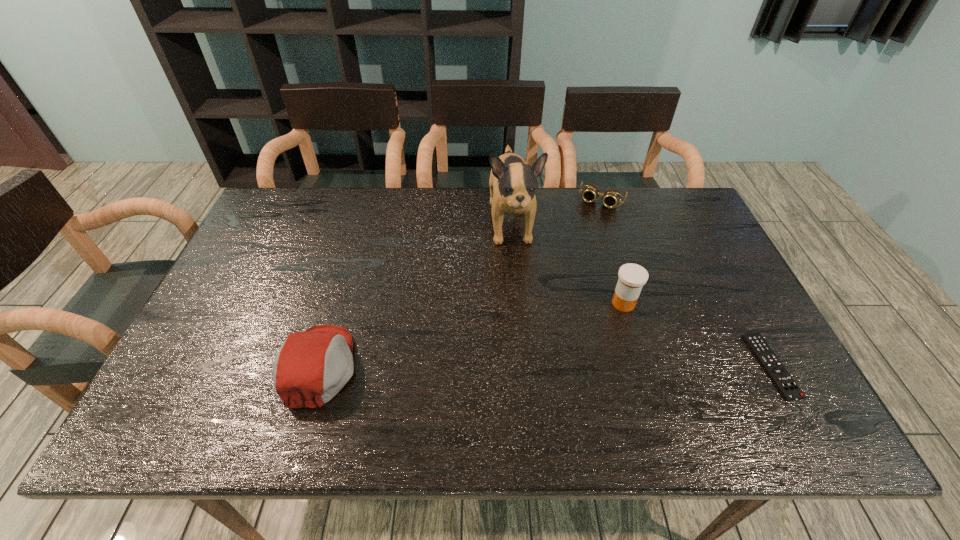
Identify which object is located as the second nearest to the cap. Please provide its 2D coordinates. Your answer should be formatted as a tuple, i.e. [(x, y)], where the tuple contains the x and y coordinates of a point satisfying the conditions above.

[(632, 277)]

Where is `object that can be found as the third closest to the fourth tallest object`? object that can be found as the third closest to the fourth tallest object is located at coordinates (784, 382).